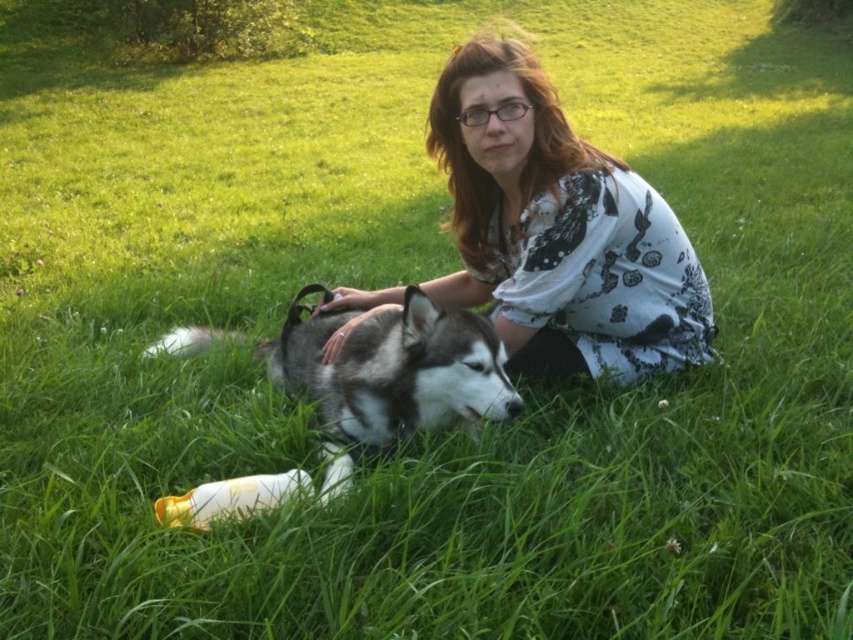
You are a person who needs to pick up the white plastic bottle at lower center. You are currently holding the white floral shirt at center. Can you reach the bottle without moving your feet?

The distance between the white floral shirt at center and the white plastic bottle at lower center is 28.46 inches. If your arm can reach at least 28.46 inches, you can pick up the bottle without moving your feet.